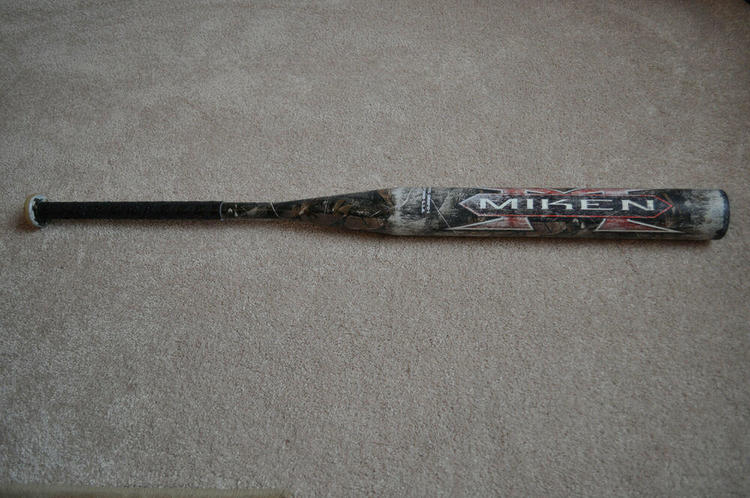
Find the location of a particular element. 1 area of beige carpet is located at coordinates (584, 421).